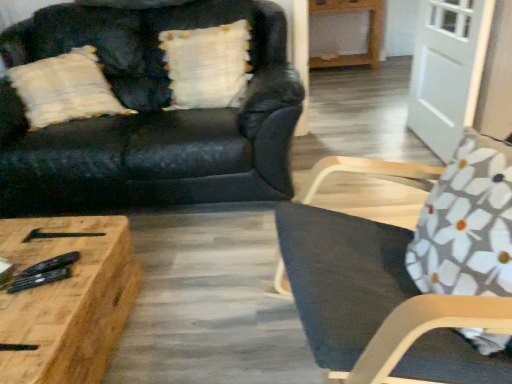
Question: Considering the relative positions of wooden coffee table at lower left and light brown wooden table at upper right in the image provided, is wooden coffee table at lower left to the right of light brown wooden table at upper right from the viewer's perspective?

Choices:
 (A) no
 (B) yes

Answer: (A)

Question: Could you tell me if wooden coffee table at lower left is turned towards light brown wooden table at upper right?

Choices:
 (A) yes
 (B) no

Answer: (B)

Question: Does wooden coffee table at lower left have a greater height compared to light brown wooden table at upper right?

Choices:
 (A) yes
 (B) no

Answer: (B)

Question: From a real-world perspective, does wooden coffee table at lower left sit lower than light brown wooden table at upper right?

Choices:
 (A) no
 (B) yes

Answer: (B)

Question: Can you confirm if wooden coffee table at lower left is thinner than light brown wooden table at upper right?

Choices:
 (A) no
 (B) yes

Answer: (A)

Question: Can you confirm if wooden coffee table at lower left is shorter than light brown wooden table at upper right?

Choices:
 (A) no
 (B) yes

Answer: (B)

Question: From the image's perspective, is dark gray fabric chair at right below white glossy door at upper right?

Choices:
 (A) no
 (B) yes

Answer: (B)

Question: Is the position of dark gray fabric chair at right more distant than that of white glossy door at upper right?

Choices:
 (A) yes
 (B) no

Answer: (B)

Question: From a real-world perspective, is dark gray fabric chair at right located beneath white glossy door at upper right?

Choices:
 (A) no
 (B) yes

Answer: (A)

Question: Is dark gray fabric chair at right positioned with its back to white glossy door at upper right?

Choices:
 (A) yes
 (B) no

Answer: (B)

Question: From a real-world perspective, is dark gray fabric chair at right over white glossy door at upper right?

Choices:
 (A) yes
 (B) no

Answer: (A)

Question: Considering the relative sizes of dark gray fabric chair at right and white glossy door at upper right in the image provided, is dark gray fabric chair at right shorter than white glossy door at upper right?

Choices:
 (A) yes
 (B) no

Answer: (B)

Question: Could dark gray fabric chair at right be considered to be inside floral fabric cushion at right?

Choices:
 (A) no
 (B) yes

Answer: (A)